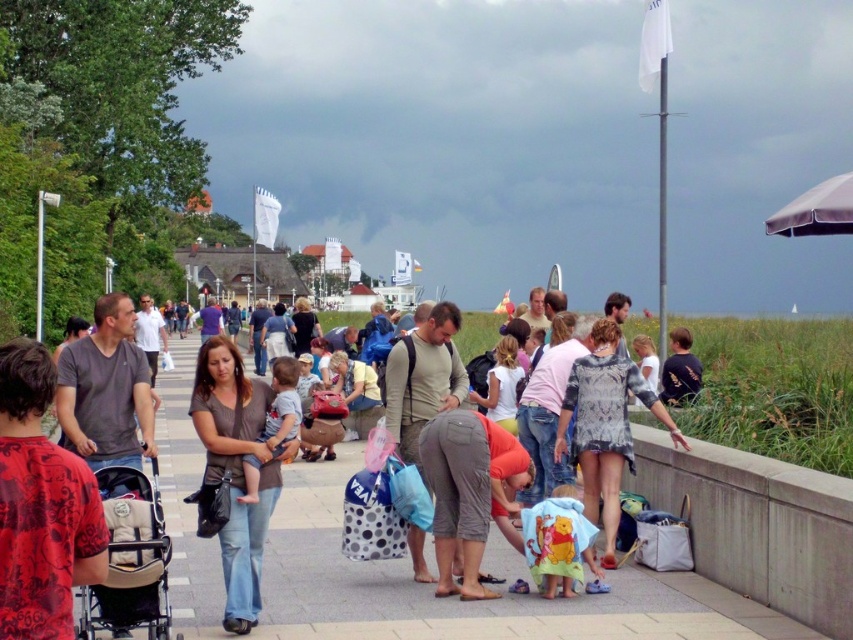
In the scene shown: You are standing at the origin point of the coordinate system. You want to reach the matte brown shirt at center. Which direction should you move in to get there?

The matte brown shirt at center is located at coordinate point 0.734 on the x axis and 0.278 on the y axis. Since you are at the origin point, you should move in the positive x and positive y direction to reach the matte brown shirt at center.

You are a photographer trying to capture a photo of the matte brown shirt at center and the beige fabric baby carriage at lower left. Since you want both subjects to appear proportionally sized in the final image, which subject should you move closer to or farther away from the camera?

The matte brown shirt at center is wider than the beige fabric baby carriage at lower left. To make them appear proportionally sized in the photo, you should move the beige fabric baby carriage at lower left closer to the camera or move the matte brown shirt at center farther away.